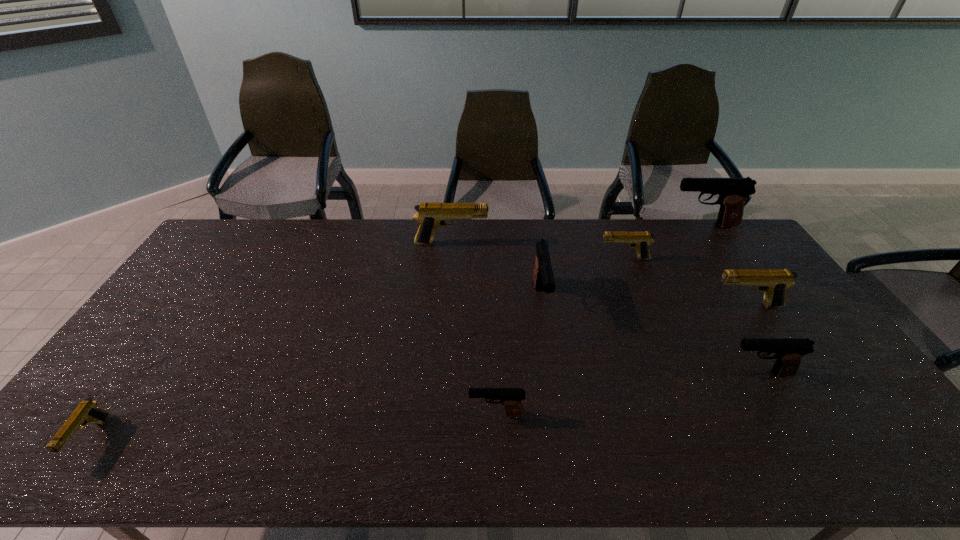
The height and width of the screenshot is (540, 960). I want to click on free space located 0.120m at the barrel of the second farthest object, so click(520, 244).

At what (x,y) coordinates should I click in order to perform the action: click on free region located at the barrel of the rightmost tan pistol. Please return your answer as a coordinate pair (x, y). Looking at the image, I should click on (649, 306).

I want to click on free space located at the barrel of the rightmost tan pistol, so click(665, 306).

Where is `blank space located 0.230m at the barrel of the rightmost tan pistol`? This screenshot has width=960, height=540. blank space located 0.230m at the barrel of the rightmost tan pistol is located at coordinates (636, 306).

In order to click on free space located at the barrel of the third nearest object in this screenshot , I will do `click(622, 374)`.

Find the location of a particular element. This screenshot has height=540, width=960. blank space located at the barrel of the third nearest object is located at coordinates (596, 374).

You are a GUI agent. You are given a task and a screenshot of the screen. Output one action in this format:
    pyautogui.click(x=<x>, y=<y>)
    Task: Click on the vacant region located 0.080m at the barrel of the third nearest object
    The width and height of the screenshot is (960, 540).
    Given the screenshot: What is the action you would take?
    pyautogui.click(x=696, y=374)

Find the location of `vacant region located 0.190m at the barrel of the second smallest tan pistol`. vacant region located 0.190m at the barrel of the second smallest tan pistol is located at coordinates point(545,259).

Identify the location of vacant position located 0.360m at the barrel of the second smallest tan pistol. This screenshot has width=960, height=540. (496, 259).

At what (x,y) coordinates should I click in order to perform the action: click on free space located at the barrel of the second smallest tan pistol. Please return your answer as a coordinate pair (x, y). Looking at the image, I should click on (534, 259).